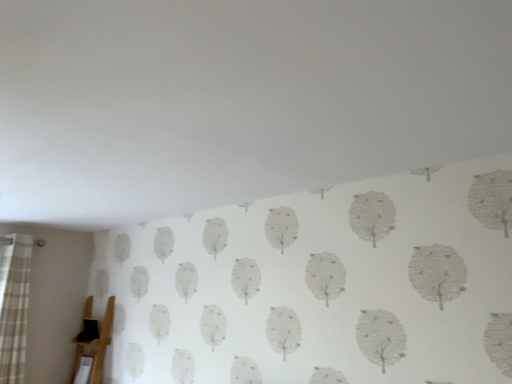
Question: Considering the positions of plaid fabric curtain at left and wooden easel at lower left in the image, is plaid fabric curtain at left wider or thinner than wooden easel at lower left?

Choices:
 (A) wide
 (B) thin

Answer: (B)

Question: Is point (3, 327) positioned closer to the camera than point (73, 380)?

Choices:
 (A) closer
 (B) farther

Answer: (A)

Question: Considering the relative positions of plaid fabric curtain at left and wooden easel at lower left in the image provided, is plaid fabric curtain at left to the left or to the right of wooden easel at lower left?

Choices:
 (A) right
 (B) left

Answer: (B)

Question: In the image, is wooden easel at lower left on the left side or the right side of plaid fabric curtain at left?

Choices:
 (A) left
 (B) right

Answer: (B)

Question: Is wooden easel at lower left bigger or smaller than plaid fabric curtain at left?

Choices:
 (A) small
 (B) big

Answer: (A)

Question: From the image's perspective, is wooden easel at lower left above or below plaid fabric curtain at left?

Choices:
 (A) below
 (B) above

Answer: (A)

Question: Considering the positions of wooden easel at lower left and plaid fabric curtain at left in the image, is wooden easel at lower left wider or thinner than plaid fabric curtain at left?

Choices:
 (A) wide
 (B) thin

Answer: (A)